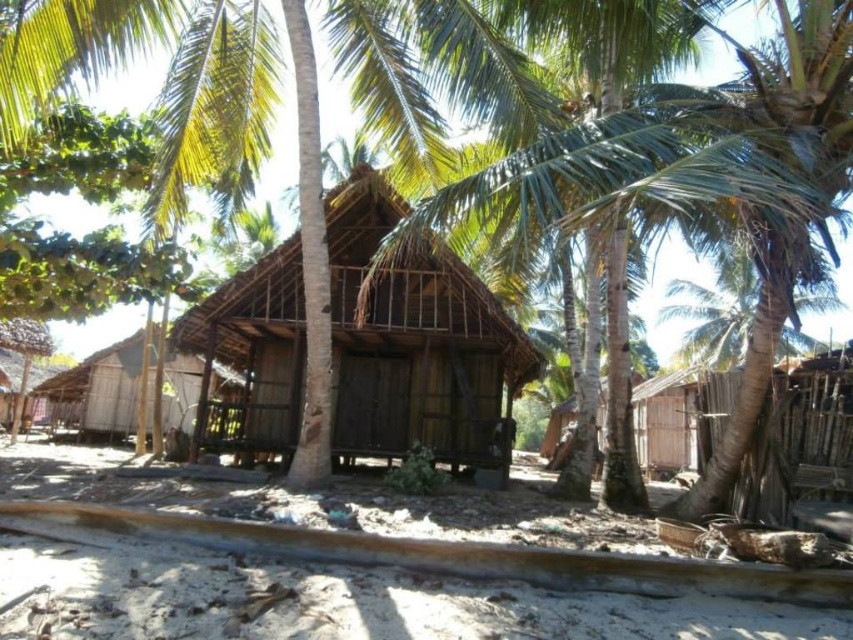
Question: Which point is farther to the camera?

Choices:
 (A) (345, 372)
 (B) (125, 353)

Answer: (B)

Question: Which point is farther from the camera taking this photo?

Choices:
 (A) (62, 456)
 (B) (396, 205)

Answer: (A)

Question: Which point appears closest to the camera in this image?

Choices:
 (A) (508, 330)
 (B) (154, 374)
 (C) (666, 602)

Answer: (C)

Question: Observing the image, what is the correct spatial positioning of smooth sand at lower center in reference to brown wooden hut at center?

Choices:
 (A) right
 (B) left

Answer: (A)

Question: Is smooth sand at lower center in front of brown wooden hut at center?

Choices:
 (A) yes
 (B) no

Answer: (A)

Question: Can you confirm if smooth sand at lower center is positioned above brown wooden hut at center?

Choices:
 (A) no
 (B) yes

Answer: (A)